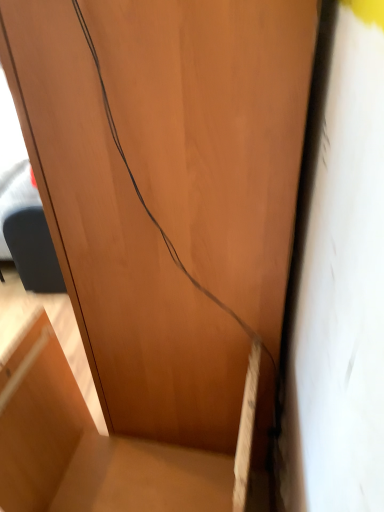
The width and height of the screenshot is (384, 512). What do you see at coordinates (88, 448) in the screenshot? I see `matte wood cabinet at center` at bounding box center [88, 448].

I want to click on matte wood cabinet at center, so click(x=88, y=448).

Identify the location of brown matte wire at center. coord(146,205).

The height and width of the screenshot is (512, 384). What do you see at coordinates (146, 205) in the screenshot?
I see `brown matte wire at center` at bounding box center [146, 205].

You are a GUI agent. You are given a task and a screenshot of the screen. Output one action in this format:
    pyautogui.click(x=<x>, y=<y>)
    Task: Click on the matte wood cabinet at center
    This screenshot has width=384, height=512.
    Given the screenshot: What is the action you would take?
    pyautogui.click(x=88, y=448)

Visually, is matte wood cabinet at center positioned to the left or to the right of brown matte wire at center?

Clearly, matte wood cabinet at center is on the left of brown matte wire at center in the image.

Does matte wood cabinet at center come in front of brown matte wire at center?

That is False.

Which point is more distant from viewer, [38,487] or [136,192]?

The point [38,487] is farther from the camera.

From the image's perspective, which one is positioned higher, matte wood cabinet at center or brown matte wire at center?

brown matte wire at center, from the image's perspective.

From a real-world perspective, between matte wood cabinet at center and brown matte wire at center, who is vertically lower?

From a 3D spatial view, matte wood cabinet at center is below.

In terms of width, does matte wood cabinet at center look wider or thinner when compared to brown matte wire at center?

In the image, matte wood cabinet at center appears to be more narrow than brown matte wire at center.

Is matte wood cabinet at center taller or shorter than brown matte wire at center?

matte wood cabinet at center is shorter than brown matte wire at center.

Can you confirm if matte wood cabinet at center is smaller than brown matte wire at center?

Correct, matte wood cabinet at center occupies less space than brown matte wire at center.

Is matte wood cabinet at center inside or outside of brown matte wire at center?

matte wood cabinet at center exists outside the volume of brown matte wire at center.

Are matte wood cabinet at center and brown matte wire at center located far from each other?

No, matte wood cabinet at center is not far away from brown matte wire at center.

Is matte wood cabinet at center facing towards brown matte wire at center?

No, matte wood cabinet at center is not oriented towards brown matte wire at center.

How different are the orientations of matte wood cabinet at center and brown matte wire at center in degrees?

81.4 degrees.

Where is `wire in front of the matte wood cabinet at center`? The height and width of the screenshot is (512, 384). wire in front of the matte wood cabinet at center is located at coordinates (146, 205).

Between brown matte wire at center and matte wood cabinet at center, which one appears on the left side from the viewer's perspective?

matte wood cabinet at center.

Does brown matte wire at center lie in front of matte wood cabinet at center?

Yes, brown matte wire at center is closer to the camera.

Does point (120, 144) come closer to viewer compared to point (198, 456)?

Yes.

From the image's perspective, is brown matte wire at center located above or below matte wood cabinet at center?

Based on their image positions, brown matte wire at center is located above matte wood cabinet at center.

From a real-world perspective, which is physically above, brown matte wire at center or matte wood cabinet at center?

brown matte wire at center is physically above.

Which of these two, brown matte wire at center or matte wood cabinet at center, is wider?

brown matte wire at center.

Looking at this image, who is taller, brown matte wire at center or matte wood cabinet at center?

Standing taller between the two is brown matte wire at center.

Which of these two, brown matte wire at center or matte wood cabinet at center, is smaller?

matte wood cabinet at center.

Based on the photo, is brown matte wire at center surrounding matte wood cabinet at center?

Actually, matte wood cabinet at center is outside brown matte wire at center.

Is brown matte wire at center next to matte wood cabinet at center and touching it?

brown matte wire at center and matte wood cabinet at center are not in contact.

Is brown matte wire at center facing towards matte wood cabinet at center?

No.

Measure the distance between brown matte wire at center and matte wood cabinet at center.

A distance of 59.01 centimeters exists between brown matte wire at center and matte wood cabinet at center.

I want to click on wire above the matte wood cabinet at center (from the image's perspective), so click(x=146, y=205).

Where is `wire that appears above the matte wood cabinet at center (from the image's perspective)`? wire that appears above the matte wood cabinet at center (from the image's perspective) is located at coordinates (146, 205).

This screenshot has width=384, height=512. I want to click on furniture that is behind the brown matte wire at center, so click(88, 448).